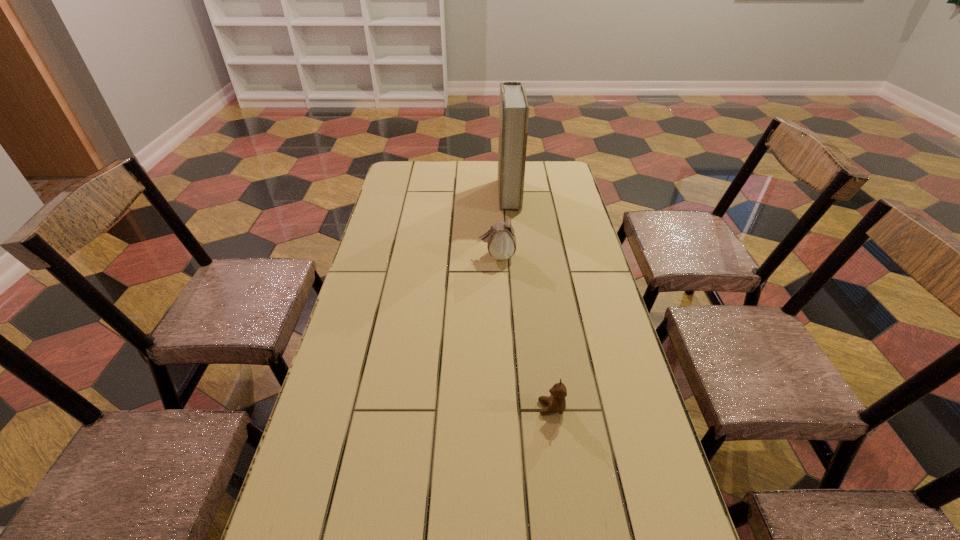
The image size is (960, 540). In order to click on the farthest object in this screenshot , I will do `click(514, 110)`.

Where is `the tallest object`? This screenshot has height=540, width=960. the tallest object is located at coordinates (514, 110).

Locate an element on the screen. pouch is located at coordinates (501, 240).

The width and height of the screenshot is (960, 540). I want to click on the second tallest object, so click(x=501, y=240).

Image resolution: width=960 pixels, height=540 pixels. What are the coordinates of `the nearest object` in the screenshot? It's located at (557, 403).

What are the coordinates of `the shortest object` in the screenshot? It's located at (557, 403).

Locate an element on the screen. free location located 0.400m on the cover of the phonebook is located at coordinates (399, 194).

At what (x,y) coordinates should I click in order to perform the action: click on free space located 0.310m on the cover of the phonebook. Please return your answer as a coordinate pair (x, y). This screenshot has width=960, height=540. Looking at the image, I should click on (421, 194).

I want to click on free location located 0.370m on the cover of the phonebook, so click(x=407, y=194).

I want to click on free space located 0.210m on the front-facing side of the second shortest object, so point(416,256).